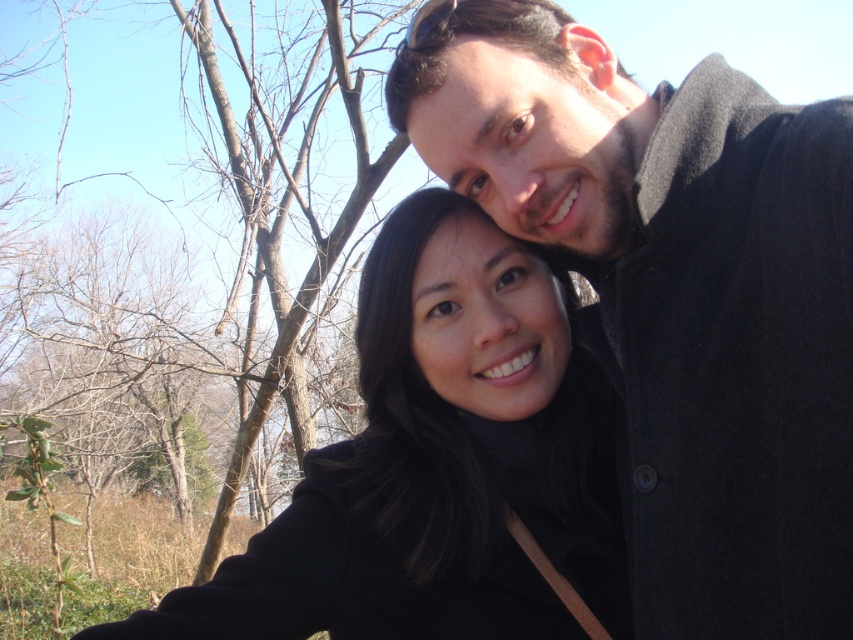
You are trying to decide which coat to choose for a day hike. You need a coat that reaches at least to your knees. Based on the image, which coat between the dark gray wool coat at upper right and the black matte coat at center would you recommend?

The dark gray wool coat at upper right is taller than the black matte coat at center, so it would reach further down and likely cover your knees better.

You are standing in a park and see the black matte coat at center and the brown leafless tree at left. Which object is closer to the ground?

The black matte coat at center is located below brown leafless tree at left, so it is closer to the ground.

You are a photographer standing 3 meters away from the black matte coat at center. You want to take a photo of the brown leafless tree at left without the coat blocking the view. Is the distance between them sufficient for you to move sideways to capture the tree without the coat obstructing the shot?

The distance between the black matte coat at center and the brown leafless tree at left is 2.68 meters. Since you are 3 meters away from the coat, moving sideways might require more space than available. The 2.68 meters between them may not be enough to position yourself such that the coat no longer blocks the tree. Therefore, it might not be possible to capture the tree without obstruction.